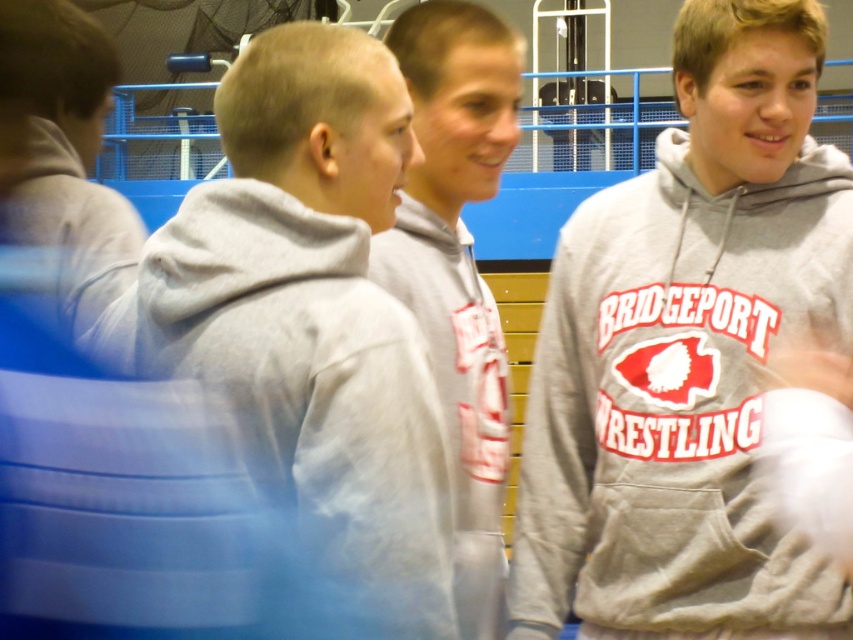
You are organizing a team photo and need to arrange the gray matte hoodie at center and the gray hoodie at left side by side. Which hoodie should be placed on the left to ensure proper alignment with the camera frame?

The gray hoodie at left should be placed on the left side since it is narrower than the gray matte hoodie at center, allowing for better alignment within the camera frame.

You are standing in the gym and see two gray hoodies. The gray matte hoodie at center and the gray hoodie at left. Which one is positioned more to the right side?

The gray matte hoodie at center is positioned to the right of gray hoodie at left, so the gray matte hoodie at center is more to the right side.